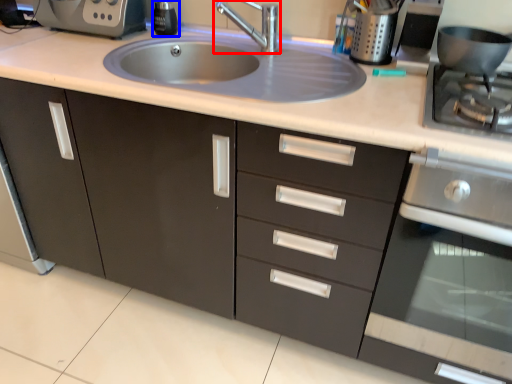
Question: Which of the following is the closest to the observer, tap (highlighted by a red box) or soap dispenser (highlighted by a blue box)?

Choices:
 (A) tap
 (B) soap dispenser

Answer: (A)